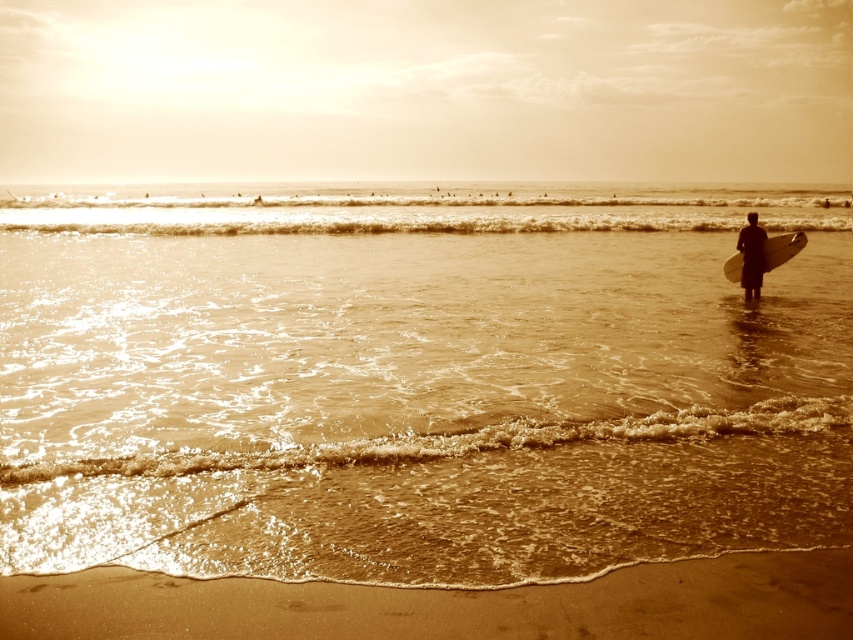
Question: Which point is closer to the camera taking this photo?

Choices:
 (A) (659, 481)
 (B) (757, 273)

Answer: (A)

Question: Can you confirm if brown water at center is smaller than sandy brown sand at lower center?

Choices:
 (A) no
 (B) yes

Answer: (A)

Question: Among these points, which one is nearest to the camera?

Choices:
 (A) (802, 328)
 (B) (740, 273)

Answer: (A)

Question: Does brown water at center have a greater width compared to white matte surfboard at right?

Choices:
 (A) yes
 (B) no

Answer: (A)

Question: Is brown water at center to the right of white matte surfboard at right from the viewer's perspective?

Choices:
 (A) yes
 (B) no

Answer: (B)

Question: Which is nearer to the black matte surfboard at right?

Choices:
 (A) brown water at center
 (B) sandy brown sand at lower center
 (C) white matte surfboard at right

Answer: (C)